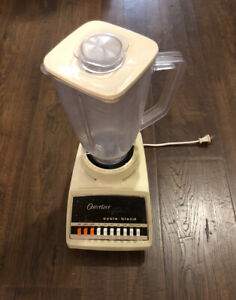
This screenshot has width=236, height=300. I want to click on power cord prongs, so click(x=212, y=136).